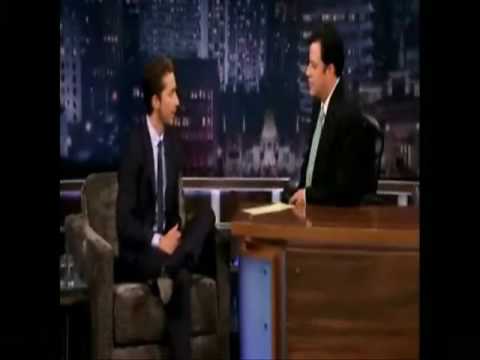
Locate an element on the screen. The image size is (480, 360). black chair back is located at coordinates (380, 129).